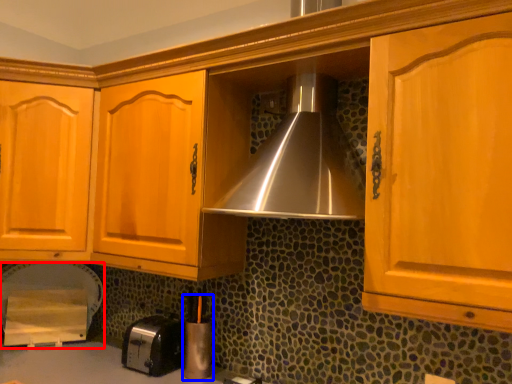
Question: Which object is closer to the camera taking this photo, appliance (highlighted by a red box) or appliance (highlighted by a blue box)?

Choices:
 (A) appliance
 (B) appliance

Answer: (B)